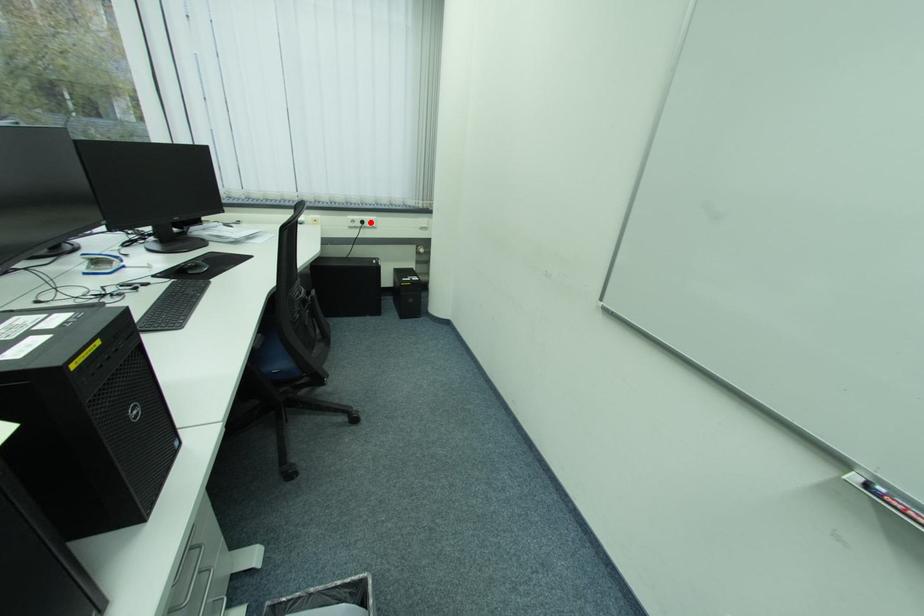
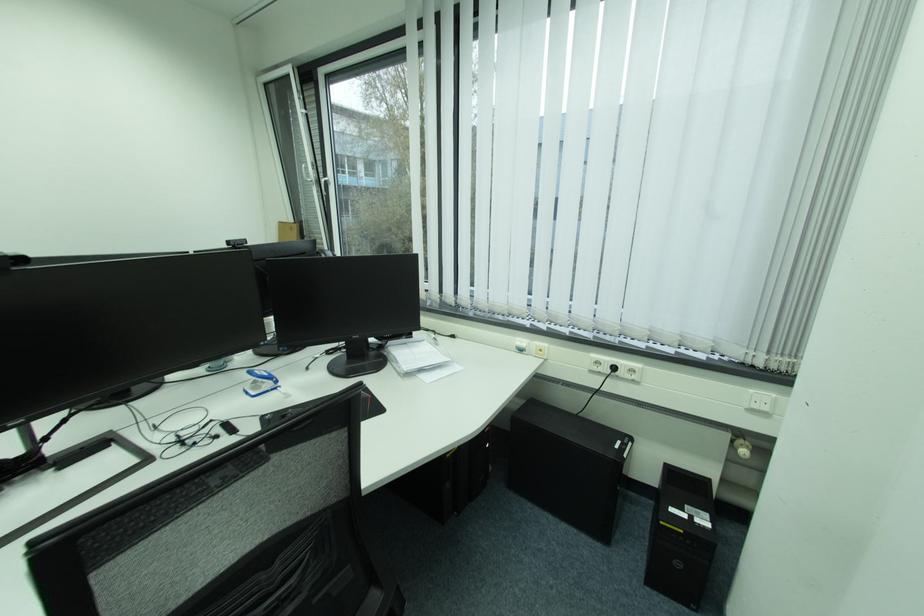
Find the pixel in the second image that matches the highlighted location in the first image.

(623, 369)